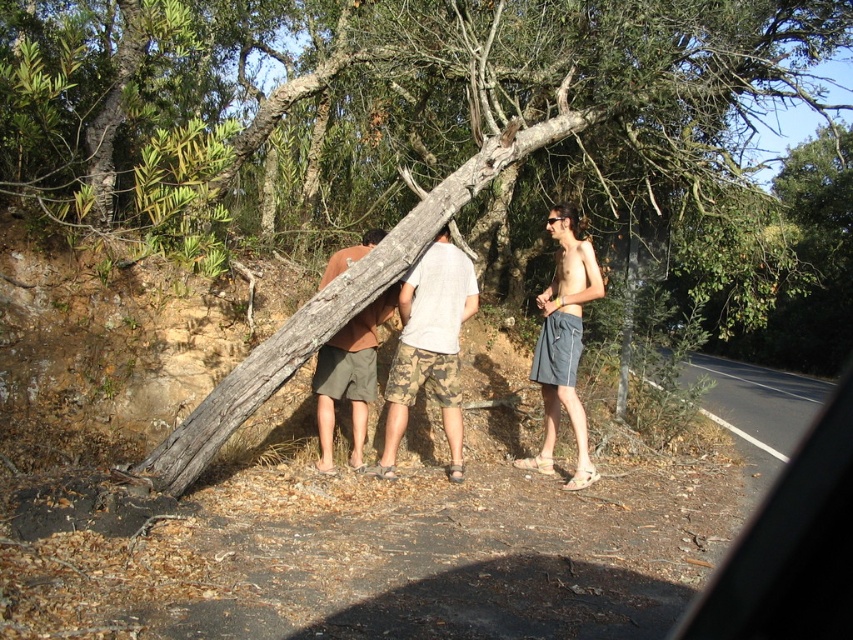
Question: Based on their relative distances, which object is nearer to the brown cotton shorts at center?

Choices:
 (A) camo shorts at center
 (B) camouflage shorts at center
 (C) gray fabric shorts at right

Answer: (A)

Question: In this image, where is camo shorts at center located relative to brown cotton shorts at center?

Choices:
 (A) right
 (B) left

Answer: (A)

Question: Which of these objects is positioned closest to the camo shorts at center?

Choices:
 (A) brown cotton shorts at center
 (B) camouflage shorts at center
 (C) gray fabric shorts at right

Answer: (A)

Question: Is camouflage shorts at center above camo shorts at center?

Choices:
 (A) no
 (B) yes

Answer: (B)

Question: Is camo shorts at center to the right of brown cotton shorts at center from the viewer's perspective?

Choices:
 (A) no
 (B) yes

Answer: (B)

Question: Which object is farther from the camera taking this photo?

Choices:
 (A) camo shorts at center
 (B) brown cotton shorts at center
 (C) gray fabric shorts at right
 (D) camouflage shorts at center

Answer: (D)